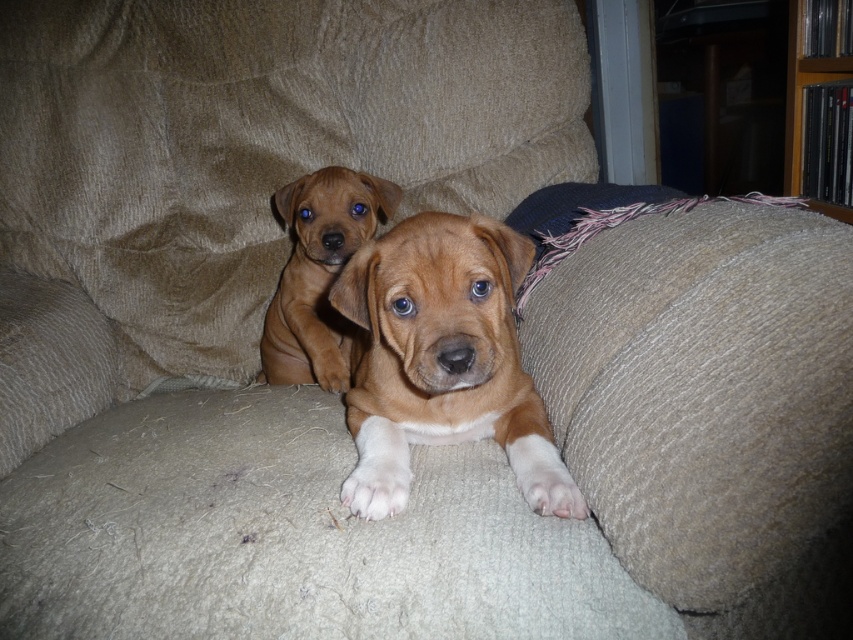
In the scene shown: Is sandy fur puppy at center positioned in front of wooden bookshelf at upper right?

Yes, it is.

Between point (325, 298) and point (822, 68), which one is positioned in front?

Point (325, 298) is more forward.

Which is in front, point (296, 380) or point (828, 77)?

Point (296, 380) is in front.

This screenshot has height=640, width=853. In order to click on sandy fur puppy at center in this screenshot , I will do `click(318, 273)`.

Between brown furry puppy at center and sandy fur puppy at center, which one is positioned higher?

sandy fur puppy at center is higher up.

Does brown furry puppy at center have a smaller size compared to sandy fur puppy at center?

Actually, brown furry puppy at center might be larger than sandy fur puppy at center.

Where is `brown furry puppy at center`? brown furry puppy at center is located at coordinates (442, 360).

Find the location of a particular element. The width and height of the screenshot is (853, 640). brown furry puppy at center is located at coordinates (442, 360).

From the picture: Between dark blue textured pillow at right and wooden bookshelf at upper right, which one is positioned higher?

wooden bookshelf at upper right is higher up.

Can you confirm if dark blue textured pillow at right is taller than wooden bookshelf at upper right?

No.

Where is `dark blue textured pillow at right`? dark blue textured pillow at right is located at coordinates (701, 388).